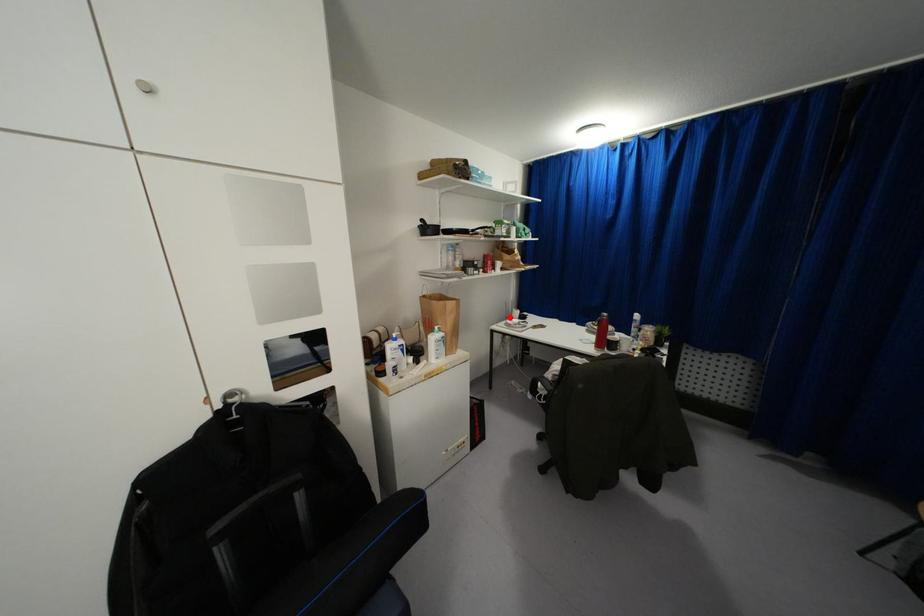
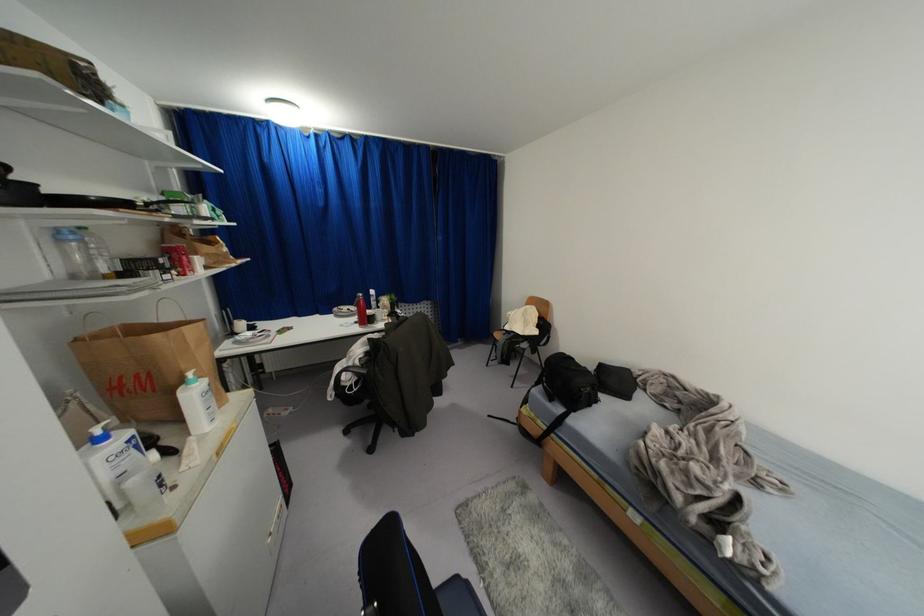
The point at the highlighted location is marked in the first image. Where is the corresponding point in the second image?

(234, 333)